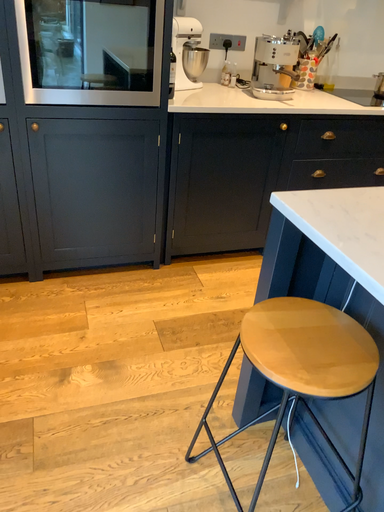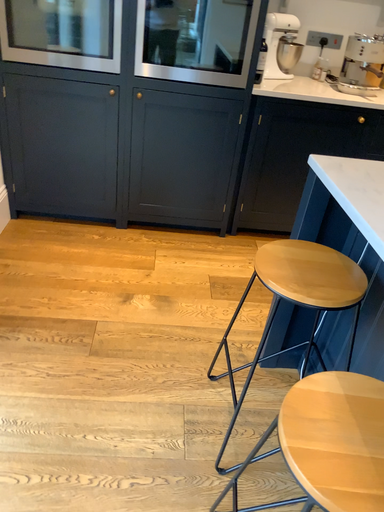
Question: How did the camera likely rotate when shooting the video?

Choices:
 (A) rotated right
 (B) rotated left

Answer: (B)